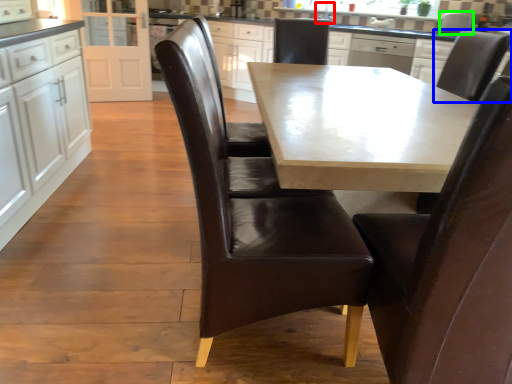
Question: Estimate the real-world distances between objects in this image. Which object is farther from sink (highlighted by a red box), chair (highlighted by a blue box) or appliance (highlighted by a green box)?

Choices:
 (A) chair
 (B) appliance

Answer: (A)